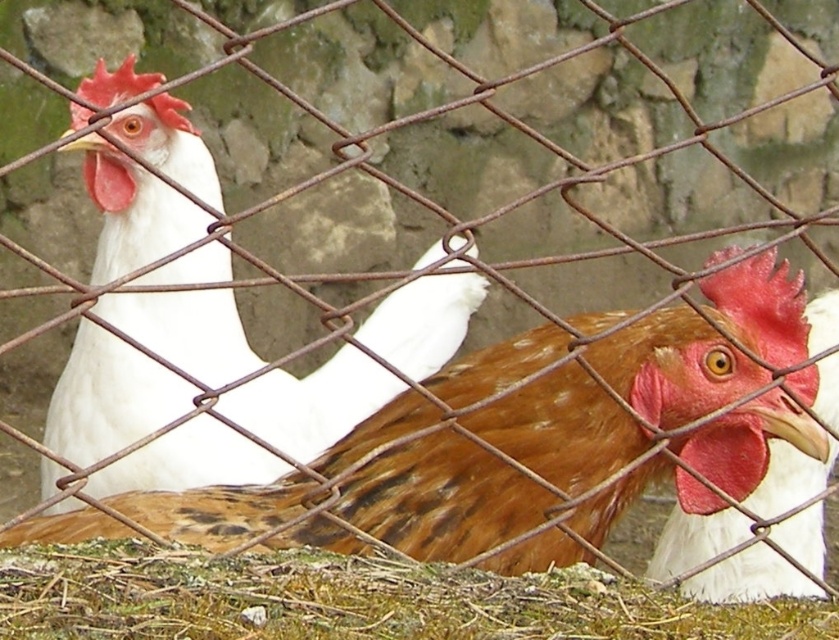
Does white matte chicken at left have a lesser height compared to brown speckled feathers at center?

In fact, white matte chicken at left may be taller than brown speckled feathers at center.

Can you confirm if white matte chicken at left is taller than brown speckled feathers at center?

Indeed, white matte chicken at left has a greater height compared to brown speckled feathers at center.

Is point (227, 257) positioned before point (796, 518)?

No, (227, 257) is behind (796, 518).

Where is `white matte chicken at left`? Image resolution: width=839 pixels, height=640 pixels. white matte chicken at left is located at coordinates (108, 397).

Is the position of brown textured hay at lower center more distant than that of brown speckled feathers at center?

No, brown textured hay at lower center is closer to the viewer.

Which is more to the right, brown textured hay at lower center or brown speckled feathers at center?

From the viewer's perspective, brown speckled feathers at center appears more on the right side.

Where is `brown textured hay at lower center`? The image size is (839, 640). brown textured hay at lower center is located at coordinates (352, 600).

Where is `brown textured hay at lower center`? brown textured hay at lower center is located at coordinates (352, 600).

Measure the distance from white matte chicken at left to brown textured hay at lower center.

white matte chicken at left and brown textured hay at lower center are 28.31 inches apart.

Is white matte chicken at left smaller than brown textured hay at lower center?

Incorrect, white matte chicken at left is not smaller in size than brown textured hay at lower center.

Between point (466, 275) and point (165, 570), which one is positioned in front?

Point (165, 570)

Locate an element on the screen. Image resolution: width=839 pixels, height=640 pixels. white matte chicken at left is located at coordinates (108, 397).